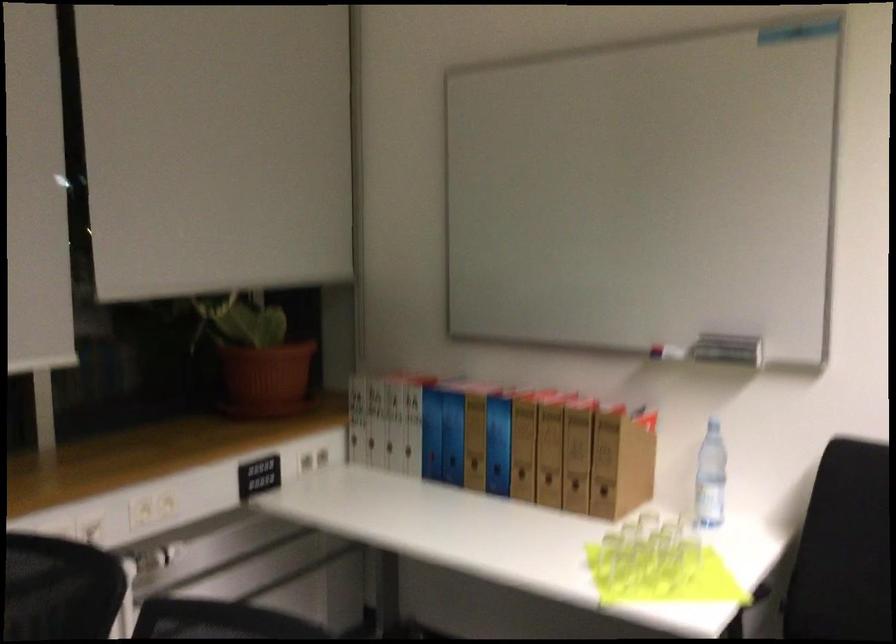
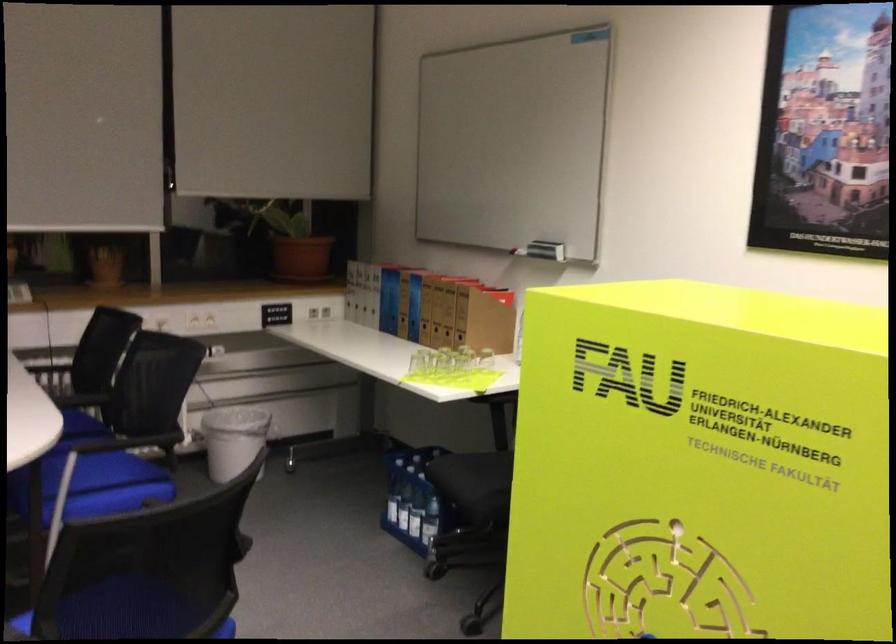
The point at (420, 466) is marked in the first image. Where is the corresponding point in the second image?

(382, 321)